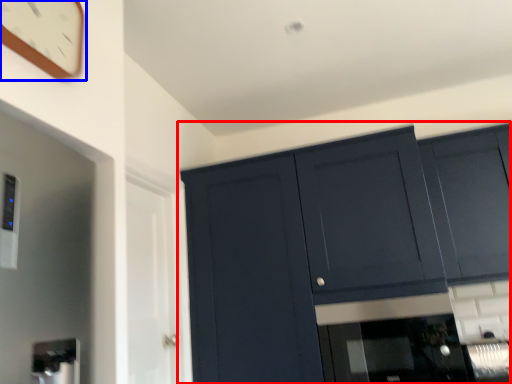
Question: Among these objects, which one is nearest to the camera, cupboard (highlighted by a red box) or clock (highlighted by a blue box)?

Choices:
 (A) cupboard
 (B) clock

Answer: (B)